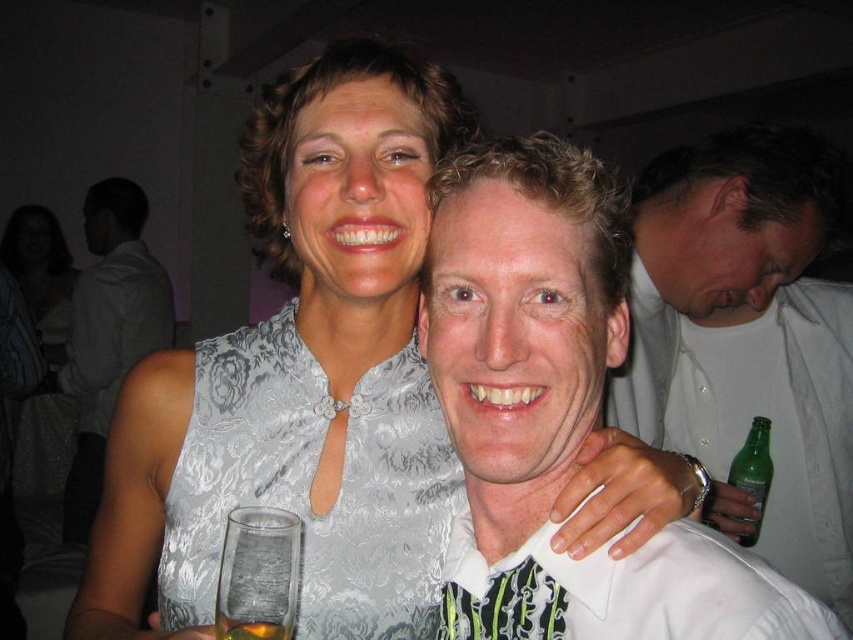
Between white satin dress at center and clear glass at center, which one has less height?

With less height is clear glass at center.

Is white satin dress at center smaller than clear glass at center?

No, white satin dress at center is not smaller than clear glass at center.

Where is `white satin dress at center`? The width and height of the screenshot is (853, 640). white satin dress at center is located at coordinates (312, 483).

Describe the element at coordinates (752, 474) in the screenshot. I see `green glass bottle at right` at that location.

Does green glass bottle at right have a smaller size compared to clear glass at center?

No, green glass bottle at right is not smaller than clear glass at center.

Measure the distance between point (761, 490) and camera.

Point (761, 490) and camera are 4.25 feet apart from each other.

At what (x,y) coordinates should I click in order to perform the action: click on green glass bottle at right. Please return your answer as a coordinate pair (x, y). The image size is (853, 640). Looking at the image, I should click on (752, 474).

The height and width of the screenshot is (640, 853). Describe the element at coordinates (108, 333) in the screenshot. I see `matte white dress at upper center` at that location.

Who is lower down, matte white dress at upper center or green glass bottle at right?

green glass bottle at right

Who is more distant from viewer, (97,426) or (753,496)?

Positioned behind is point (97,426).

Image resolution: width=853 pixels, height=640 pixels. Find the location of `matte white dress at upper center`. matte white dress at upper center is located at coordinates (108, 333).